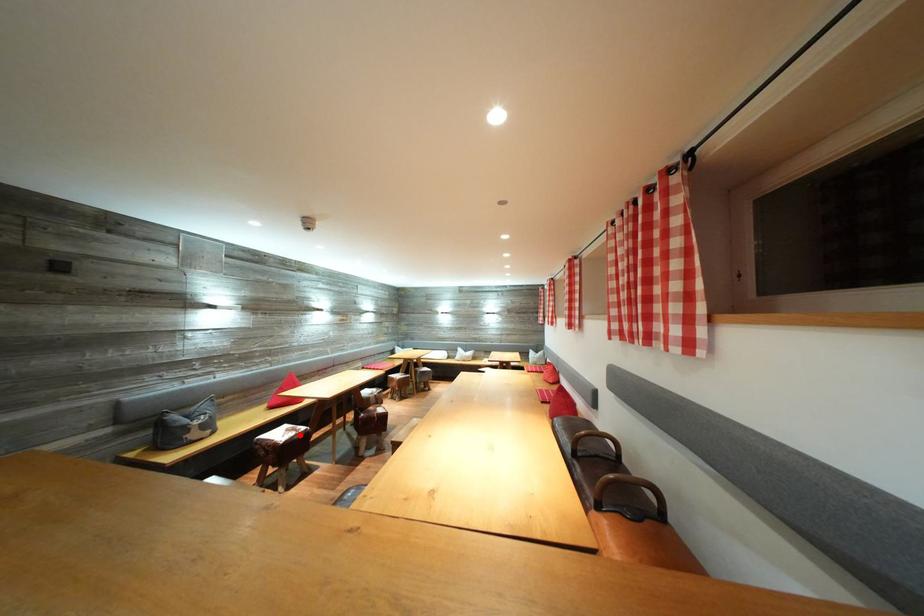
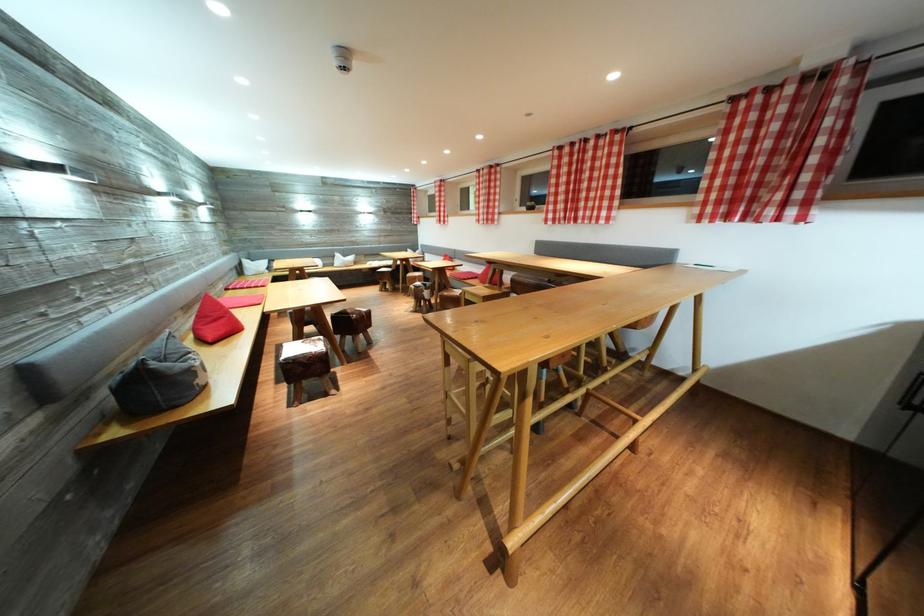
Question: I am providing you with two images of the same scene from different viewpoints. Image1 has a red point marked. In image2, the corresponding 3D location appears at what relative position? Reply with the corresponding letter.

Choices:
 (A) Closer
 (B) Farther

Answer: (A)